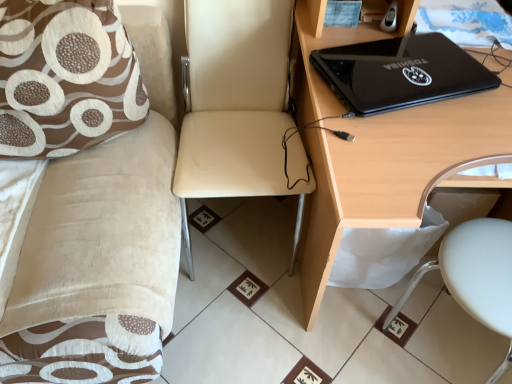
Where is `free space in front of beige leather chair at center`? Image resolution: width=512 pixels, height=384 pixels. free space in front of beige leather chair at center is located at coordinates 260,324.